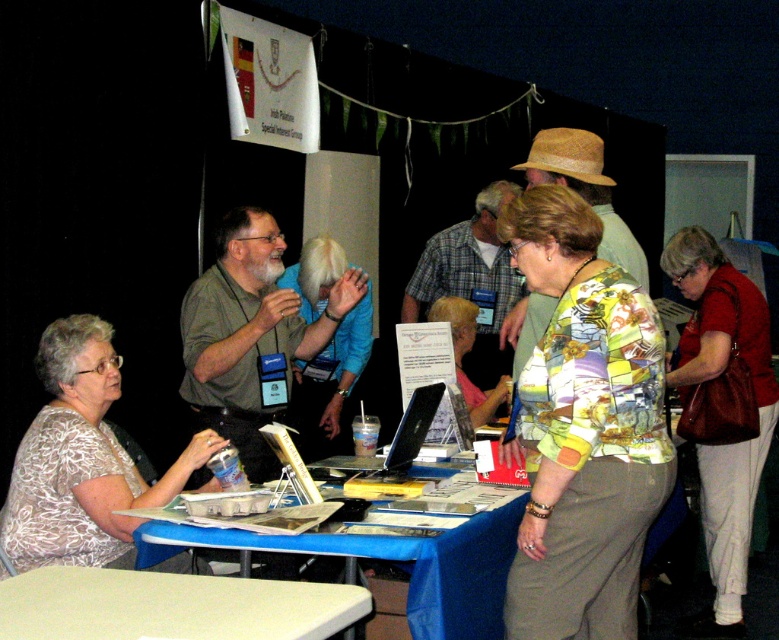
You are standing in front of the table at the community event. You see a point marked at coordinates (80, 460). What object is located at that point?

The point at coordinates (80, 460) indicates the white floral blouse at lower left.

You are standing at the entrance of the community event and want to reach the soda can located at point (335, 593). There is an obstacle at point (481, 392) blocking your path. Can you walk directly to the soda can without going around the obstacle?

Yes, you can walk directly to the soda can located at point (335, 593) because it is in front of the obstacle at point (481, 392), meaning the obstacle is behind the soda can and not blocking your path.